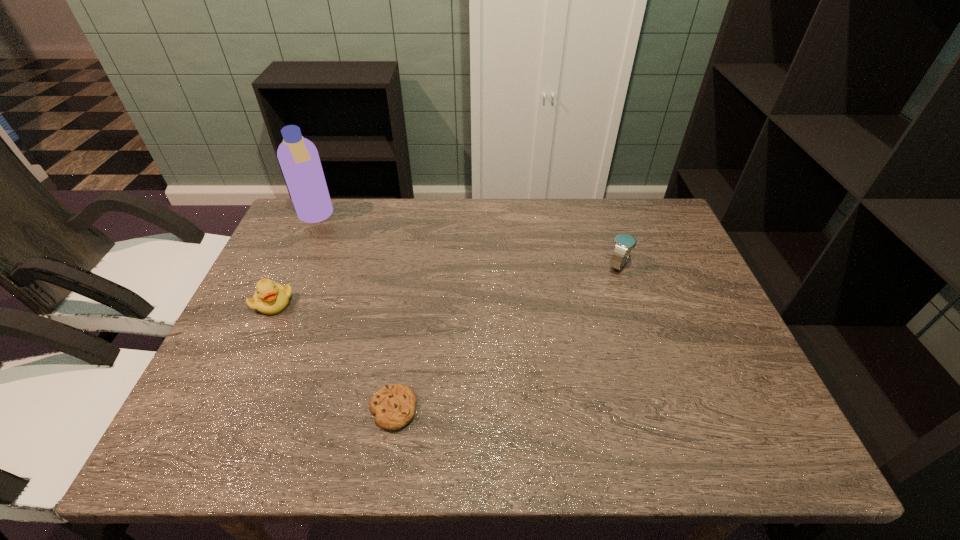
You are a GUI agent. You are given a task and a screenshot of the screen. Output one action in this format:
    pyautogui.click(x=<x>, y=<y>)
    Task: Click on the free spot between the farthest object and the shortest object
    
    Given the screenshot: What is the action you would take?
    pyautogui.click(x=354, y=313)

You are a GUI agent. You are given a task and a screenshot of the screen. Output one action in this format:
    pyautogui.click(x=<x>, y=<y>)
    Task: Click on the vacant area that lies between the duckling and the rightmost object
    The image size is (960, 540).
    Given the screenshot: What is the action you would take?
    pyautogui.click(x=446, y=284)

Identify which object is the nearest to the cookie. Please provide its 2D coordinates. Your answer should be formatted as a tuple, i.e. [(x, y)], where the tuple contains the x and y coordinates of a point satisfying the conditions above.

[(270, 298)]

Identify the location of object that can be found as the second closest to the rightmost object. The image size is (960, 540). 298,157.

Image resolution: width=960 pixels, height=540 pixels. In order to click on free spot that satisfies the following two spatial constraints: 1. on the back side of the third nearest object; 2. on the right side of the cookie in this screenshot , I will do `click(416, 265)`.

Where is `free space in the image that satisfies the following two spatial constraints: 1. on the beak of the shortest object; 2. on the left side of the duckling`? The image size is (960, 540). free space in the image that satisfies the following two spatial constraints: 1. on the beak of the shortest object; 2. on the left side of the duckling is located at coordinates (225, 409).